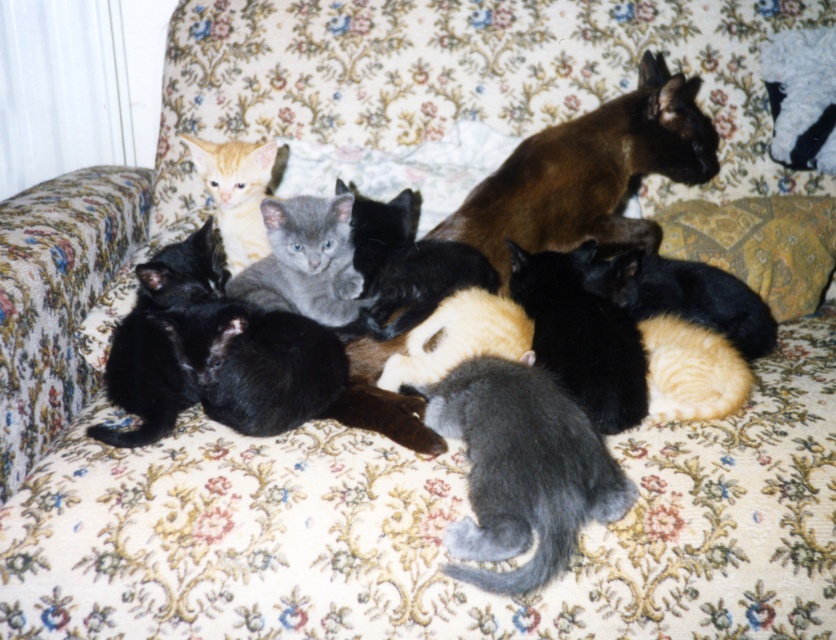
Question: Among these objects, which one is farthest from the camera?

Choices:
 (A) orange fur kitten at upper left
 (B) yellow paisley pillow at upper right

Answer: (B)

Question: Observing the image, what is the correct spatial positioning of yellow paisley pillow at upper right in reference to orange fur kitten at upper left?

Choices:
 (A) above
 (B) below

Answer: (B)

Question: Does brown silky cat at upper right have a smaller size compared to yellow paisley pillow at upper right?

Choices:
 (A) no
 (B) yes

Answer: (A)

Question: Which of the following is the farthest from the observer?

Choices:
 (A) yellow paisley pillow at upper right
 (B) orange fur kitten at upper left

Answer: (A)

Question: Does brown silky cat at upper right appear on the left side of yellow paisley pillow at upper right?

Choices:
 (A) no
 (B) yes

Answer: (B)

Question: Among these points, which one is nearest to the camera?

Choices:
 (A) (237, 234)
 (B) (702, 204)

Answer: (A)